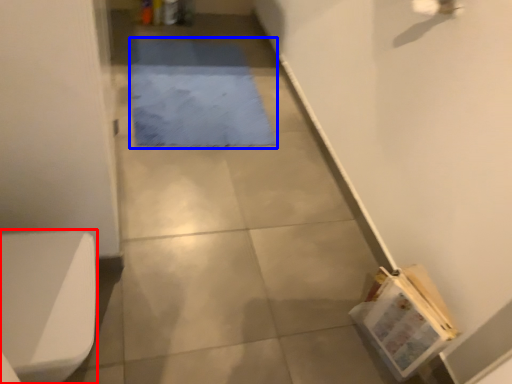
Question: Which object is further to the camera taking this photo, toilet bowl (highlighted by a red box) or mat (highlighted by a blue box)?

Choices:
 (A) toilet bowl
 (B) mat

Answer: (B)